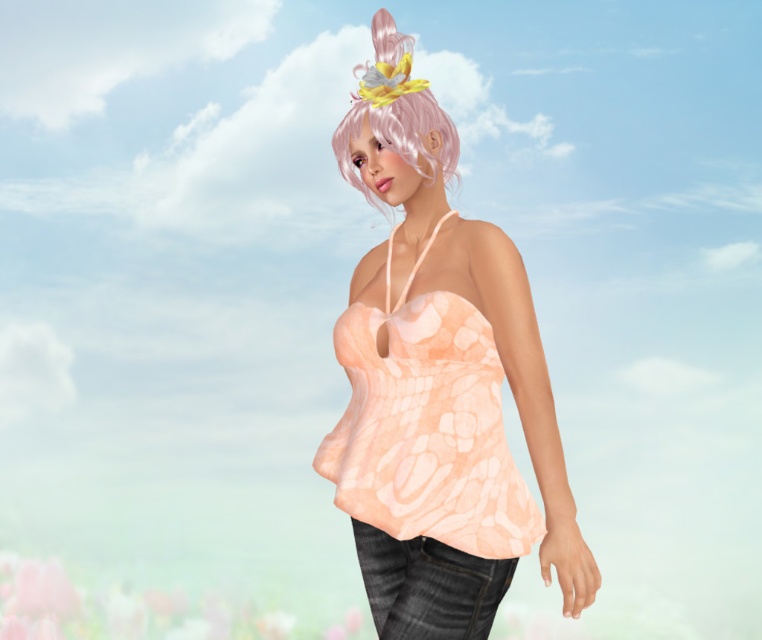
Question: Which is farther from the pink matte wig at upper center?

Choices:
 (A) peachy fabric top at center
 (B) pastel peach fabric dress at center

Answer: (B)

Question: Which of the following is the closest to the observer?

Choices:
 (A) peachy fabric top at center
 (B) pink matte wig at upper center
 (C) pastel peach fabric dress at center

Answer: (A)

Question: Which of the following is the farthest from the observer?

Choices:
 (A) pink matte wig at upper center
 (B) peachy fabric top at center
 (C) pastel peach fabric dress at center

Answer: (A)

Question: Can you confirm if peachy fabric top at center is positioned below pink matte wig at upper center?

Choices:
 (A) no
 (B) yes

Answer: (B)

Question: Does pastel peach fabric dress at center have a smaller size compared to pink matte wig at upper center?

Choices:
 (A) no
 (B) yes

Answer: (A)

Question: Is the position of peachy fabric top at center less distant than that of pink matte wig at upper center?

Choices:
 (A) yes
 (B) no

Answer: (A)